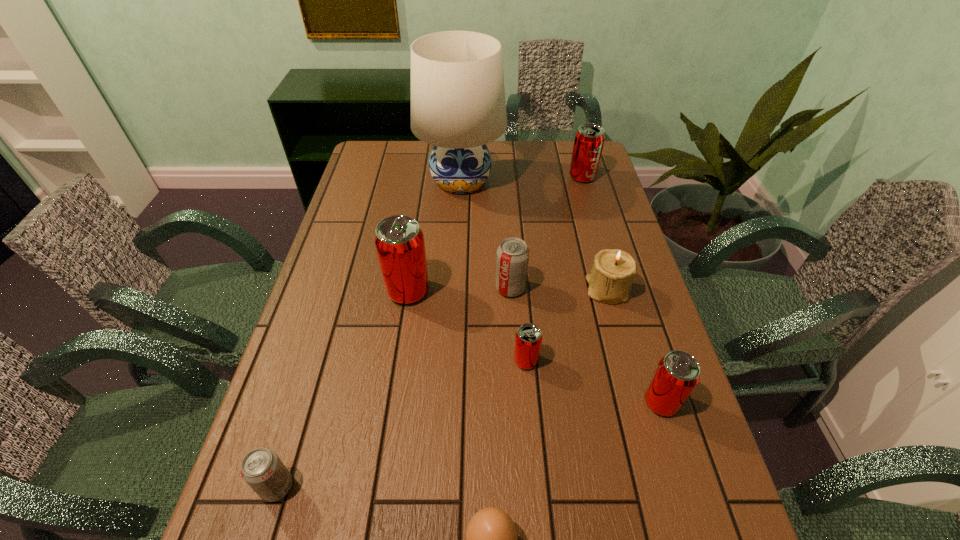
Where is `the tallest object`? Image resolution: width=960 pixels, height=540 pixels. the tallest object is located at coordinates (458, 104).

Identify the location of blue lampshade. This screenshot has height=540, width=960. (458, 104).

Locate an element on the screen. This screenshot has height=540, width=960. the tallest soda can is located at coordinates (399, 241).

The image size is (960, 540). Identify the location of the second tallest object. (399, 241).

This screenshot has width=960, height=540. Find the location of `the second tallest soda can`. the second tallest soda can is located at coordinates (589, 140).

Identify the location of the farthest soda can. (589, 140).

Where is `beige candle_holder`? beige candle_holder is located at coordinates (610, 280).

Where is `the bigger gray soda can`? the bigger gray soda can is located at coordinates (512, 260).

Locate an element on the screen. the right gray soda can is located at coordinates (512, 260).

Find the location of a particular element. the fifth farthest soda can is located at coordinates (677, 373).